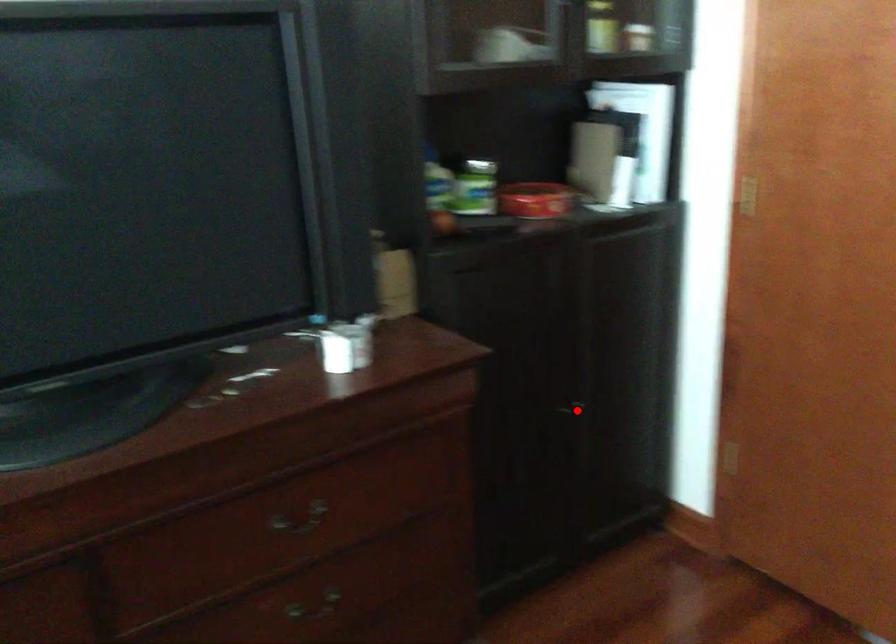
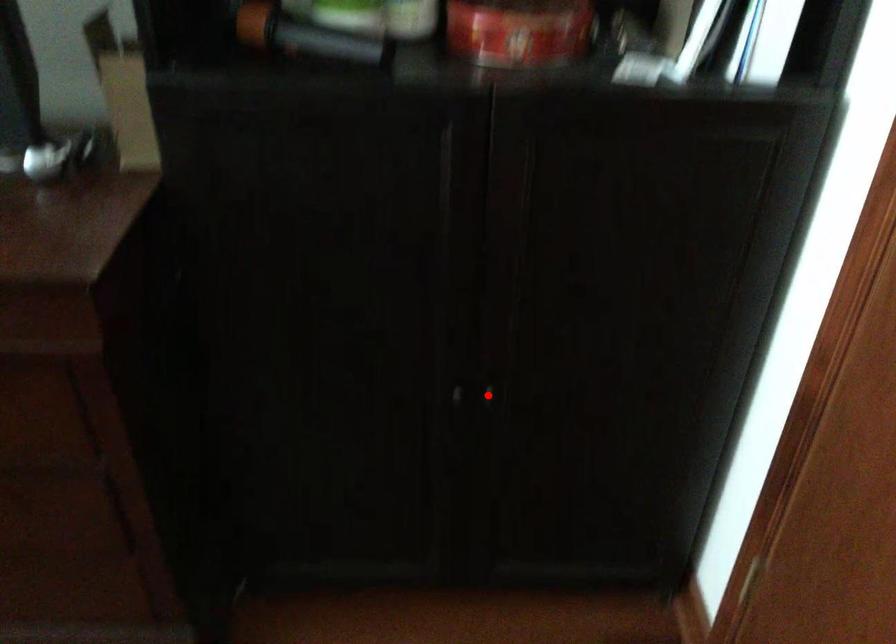
I am providing you with two images of the same scene from different viewpoints. A red point is marked on the first image and another point is marked on the second image. Do the highlighted points in image1 and image2 indicate the same real-world spot?

Yes